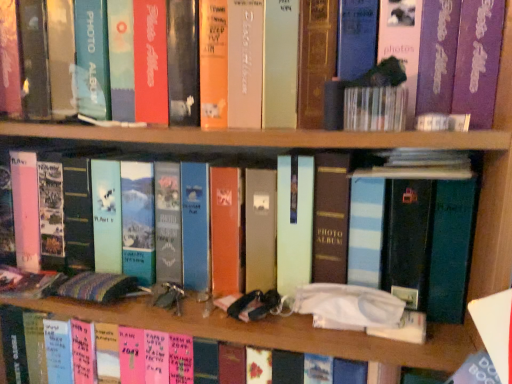
Measure the distance between blue striped photo album at center, the first book in the top-to-bottom sequence, and camera.

The depth of blue striped photo album at center, the first book in the top-to-bottom sequence, is 23.30 inches.

What is the approximate height of blue striped photo album at center, the first book in the top-to-bottom sequence?

The height of blue striped photo album at center, the first book in the top-to-bottom sequence, is 9.70 inches.

The height and width of the screenshot is (384, 512). Describe the element at coordinates (413, 238) in the screenshot. I see `blue striped photo album at center, the 2th book from the bottom` at that location.

Image resolution: width=512 pixels, height=384 pixels. In order to click on blue striped photo album at center, the first book in the top-to-bottom sequence in this screenshot , I will do `click(413, 238)`.

Locate an element on the screen. white matte tissue box at center, arranged as the first book when ordered from the bottom is located at coordinates click(230, 328).

The height and width of the screenshot is (384, 512). What do you see at coordinates (230, 328) in the screenshot?
I see `white matte tissue box at center, which is the second book in top-to-bottom order` at bounding box center [230, 328].

The width and height of the screenshot is (512, 384). I want to click on blue striped photo album at center, the first book in the top-to-bottom sequence, so click(x=413, y=238).

Is white matte tissue box at center, which is the second book in top-to-bottom order, at the left side of blue striped photo album at center, the 2th book from the bottom?

No, white matte tissue box at center, which is the second book in top-to-bottom order, is not to the left of blue striped photo album at center, the 2th book from the bottom.

From the picture: Who is more distant, white matte tissue box at center, which is the second book in top-to-bottom order, or blue striped photo album at center, the first book in the top-to-bottom sequence?

white matte tissue box at center, which is the second book in top-to-bottom order, is more distant.

Between point (275, 330) and point (195, 202), which one is positioned in front?

The point (275, 330) is closer.

From the image's perspective, is white matte tissue box at center, arranged as the first book when ordered from the bottom, located above or below blue striped photo album at center, the 2th book from the bottom?

Based on their image positions, white matte tissue box at center, arranged as the first book when ordered from the bottom, is located beneath blue striped photo album at center, the 2th book from the bottom.

From a real-world perspective, which is physically above, white matte tissue box at center, arranged as the first book when ordered from the bottom, or blue striped photo album at center, the 2th book from the bottom?

blue striped photo album at center, the 2th book from the bottom, from a real-world perspective.

Which of these two, white matte tissue box at center, arranged as the first book when ordered from the bottom, or blue striped photo album at center, the 2th book from the bottom, is wider?

white matte tissue box at center, arranged as the first book when ordered from the bottom.

In terms of height, does white matte tissue box at center, arranged as the first book when ordered from the bottom, look taller or shorter compared to blue striped photo album at center, the first book in the top-to-bottom sequence?

In the image, white matte tissue box at center, arranged as the first book when ordered from the bottom, appears to be taller than blue striped photo album at center, the first book in the top-to-bottom sequence.

Is white matte tissue box at center, which is the second book in top-to-bottom order, bigger than blue striped photo album at center, the 2th book from the bottom?

Indeed, white matte tissue box at center, which is the second book in top-to-bottom order, has a larger size compared to blue striped photo album at center, the 2th book from the bottom.

Choose the correct answer: Is white matte tissue box at center, arranged as the first book when ordered from the bottom, inside blue striped photo album at center, the first book in the top-to-bottom sequence, or outside it?

white matte tissue box at center, arranged as the first book when ordered from the bottom, exists outside the volume of blue striped photo album at center, the first book in the top-to-bottom sequence.

Is white matte tissue box at center, which is the second book in top-to-bottom order, touching blue striped photo album at center, the 2th book from the bottom?

There is a gap between white matte tissue box at center, which is the second book in top-to-bottom order, and blue striped photo album at center, the 2th book from the bottom.

Is white matte tissue box at center, arranged as the first book when ordered from the bottom, oriented away from blue striped photo album at center, the first book in the top-to-bottom sequence?

No, white matte tissue box at center, arranged as the first book when ordered from the bottom, is not facing the opposite direction of blue striped photo album at center, the first book in the top-to-bottom sequence.

Find the location of a particular element. This screenshot has height=384, width=512. book below the blue striped photo album at center, the first book in the top-to-bottom sequence (from the image's perspective) is located at coordinates (230, 328).

Would you say blue striped photo album at center, the first book in the top-to-bottom sequence, is to the left or to the right of white matte tissue box at center, arranged as the first book when ordered from the bottom, in the picture?

From the image, it's evident that blue striped photo album at center, the first book in the top-to-bottom sequence, is to the left of white matte tissue box at center, arranged as the first book when ordered from the bottom.

Between blue striped photo album at center, the 2th book from the bottom, and white matte tissue box at center, which is the second book in top-to-bottom order, which one is positioned in front?

Positioned in front is blue striped photo album at center, the 2th book from the bottom.

Does point (373, 266) come closer to viewer compared to point (198, 309)?

Yes, it is.

Consider the image. From the image's perspective, is blue striped photo album at center, the first book in the top-to-bottom sequence, located above white matte tissue box at center, which is the second book in top-to-bottom order?

Correct, blue striped photo album at center, the first book in the top-to-bottom sequence, appears higher than white matte tissue box at center, which is the second book in top-to-bottom order, in the image.

From a real-world perspective, between blue striped photo album at center, the 2th book from the bottom, and white matte tissue box at center, which is the second book in top-to-bottom order, who is vertically higher?

In real-world perspective, blue striped photo album at center, the 2th book from the bottom, is above.

Is blue striped photo album at center, the 2th book from the bottom, wider than white matte tissue box at center, arranged as the first book when ordered from the bottom?

Incorrect, the width of blue striped photo album at center, the 2th book from the bottom, does not surpass that of white matte tissue box at center, arranged as the first book when ordered from the bottom.

Is blue striped photo album at center, the 2th book from the bottom, taller or shorter than white matte tissue box at center, which is the second book in top-to-bottom order?

In the image, blue striped photo album at center, the 2th book from the bottom, appears to be shorter than white matte tissue box at center, which is the second book in top-to-bottom order.

Is blue striped photo album at center, the 2th book from the bottom, smaller than white matte tissue box at center, which is the second book in top-to-bottom order?

Correct, blue striped photo album at center, the 2th book from the bottom, occupies less space than white matte tissue box at center, which is the second book in top-to-bottom order.

Is blue striped photo album at center, the first book in the top-to-bottom sequence, inside the boundaries of white matte tissue box at center, arranged as the first book when ordered from the bottom, or outside?

The correct answer is: outside.

Would you consider blue striped photo album at center, the 2th book from the bottom, to be distant from white matte tissue box at center, arranged as the first book when ordered from the bottom?

They are positioned close to each other.

Is blue striped photo album at center, the first book in the top-to-bottom sequence, looking in the opposite direction of white matte tissue box at center, which is the second book in top-to-bottom order?

blue striped photo album at center, the first book in the top-to-bottom sequence, does not have its back to white matte tissue box at center, which is the second book in top-to-bottom order.

Could you measure the distance between blue striped photo album at center, the 2th book from the bottom, and white matte tissue box at center, arranged as the first book when ordered from the bottom?

blue striped photo album at center, the 2th book from the bottom, is 18.16 centimeters from white matte tissue box at center, arranged as the first book when ordered from the bottom.

Locate an element on the screen. This screenshot has height=384, width=512. book located on the right of blue striped photo album at center, the first book in the top-to-bottom sequence is located at coordinates (230, 328).

Where is `book on the left of white matte tissue box at center, which is the second book in top-to-bottom order`? book on the left of white matte tissue box at center, which is the second book in top-to-bottom order is located at coordinates (413, 238).

You are a GUI agent. You are given a task and a screenshot of the screen. Output one action in this format:
    pyautogui.click(x=<x>, y=<y>)
    Task: Click on the book that appears below the blue striped photo album at center, the 2th book from the bottom (from the image's perspective)
    
    Given the screenshot: What is the action you would take?
    pyautogui.click(x=230, y=328)